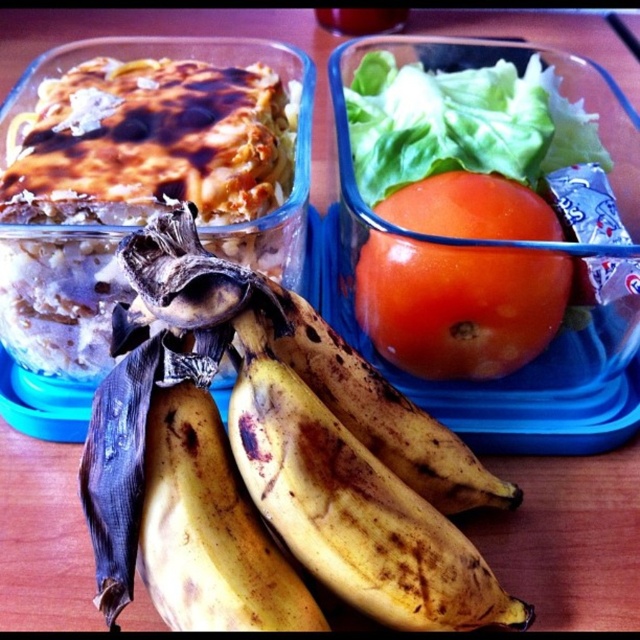
Question: Can you confirm if ripe yellow banana at lower left is positioned to the right of red matte tomato at center?

Choices:
 (A) no
 (B) yes

Answer: (A)

Question: Based on their relative distances, which object is farther from the ripe yellow banana at lower left?

Choices:
 (A) red matte tomato at center
 (B) green leafy lettuce at upper center

Answer: (B)

Question: Which object appears farthest from the camera in this image?

Choices:
 (A) red matte tomato at center
 (B) green leafy lettuce at upper center

Answer: (A)

Question: Is ripe yellow banana at lower left thinner than red matte tomato at center?

Choices:
 (A) yes
 (B) no

Answer: (B)

Question: Can you confirm if ripe yellow banana at lower left is positioned to the left of red matte tomato at center?

Choices:
 (A) yes
 (B) no

Answer: (A)

Question: Which point appears farthest from the camera in this image?

Choices:
 (A) (474, 564)
 (B) (422, 198)
 (C) (534, 138)

Answer: (C)